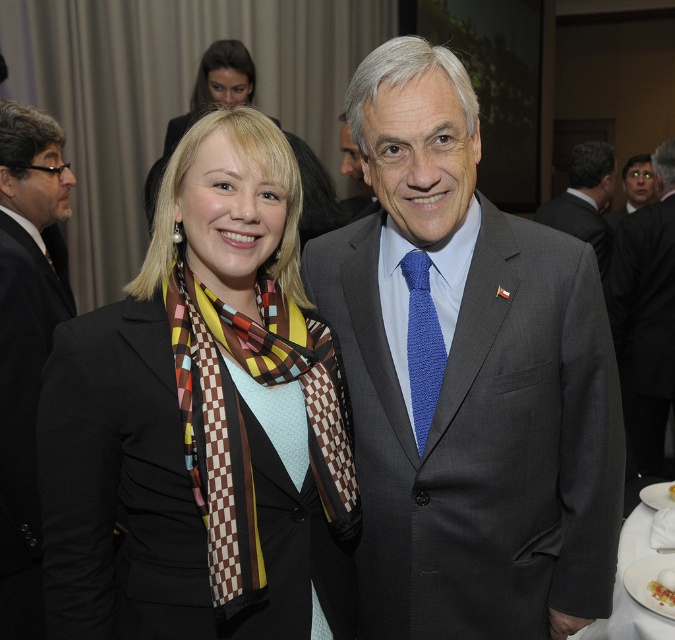
Question: Does matte gray suit at center appear on the left side of black suit at left?

Choices:
 (A) no
 (B) yes

Answer: (A)

Question: Can you confirm if dark gray suit at right is positioned to the right of blue knitted tie at center?

Choices:
 (A) no
 (B) yes

Answer: (B)

Question: Considering the real-world distances, which object is closest to the matte black suit at upper right?

Choices:
 (A) dark gray suit at center
 (B) dark gray suit at right
 (C) blue knitted tie at center
 (D) black suit at left

Answer: (B)

Question: Is black suit at left bigger than matte black suit at upper right?

Choices:
 (A) no
 (B) yes

Answer: (A)

Question: Which is farther from the dark gray suit at center?

Choices:
 (A) matte gray suit at center
 (B) multicolored scarf at center

Answer: (B)

Question: Which object appears closest to the camera in this image?

Choices:
 (A) dark gray suit at center
 (B) matte gray suit at center

Answer: (B)